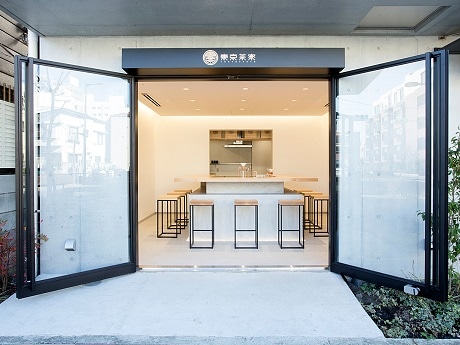
The width and height of the screenshot is (460, 345). I want to click on stool, so click(188, 188), click(183, 195), click(171, 200), click(199, 203), click(246, 205), click(291, 205), click(319, 199), click(309, 194), click(298, 190).